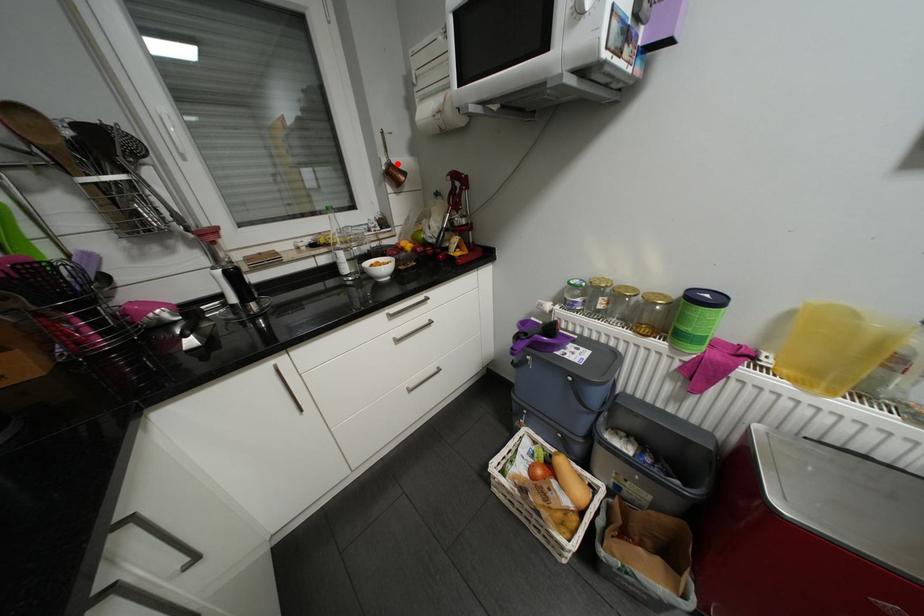
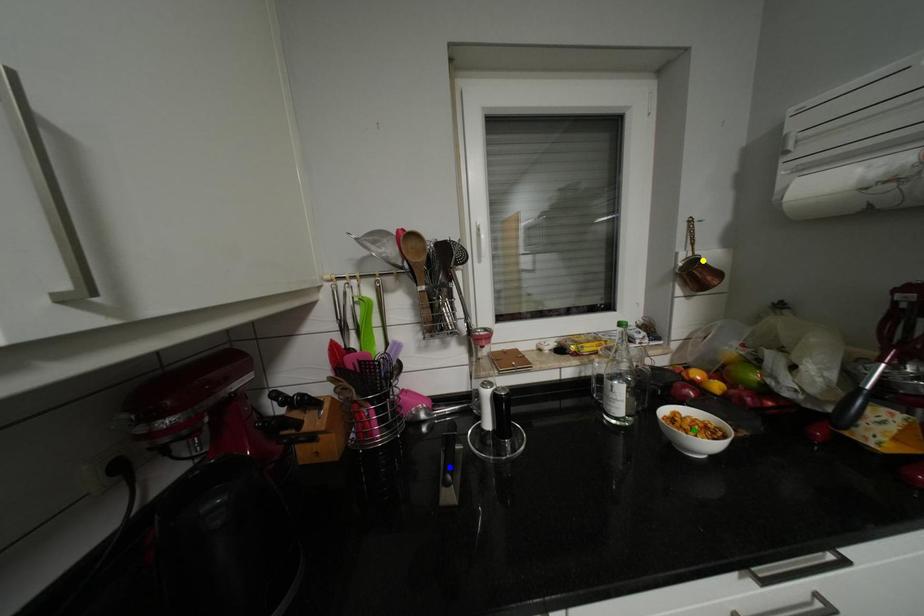
Question: I am providing you with two images of the same scene from different viewpoints. A red point is marked on the first image. You are given multiple points on the second image. Which mark in image 2 goes with the point in image 1?

Choices:
 (A) yellow point
 (B) green point
 (C) blue point

Answer: (A)